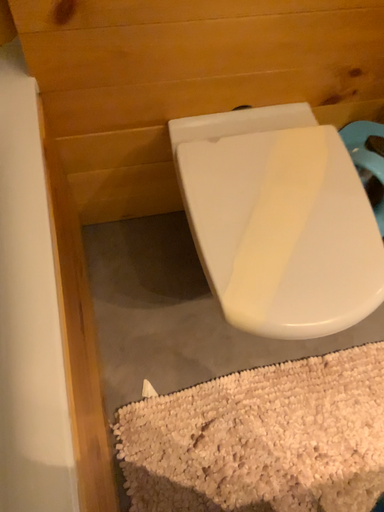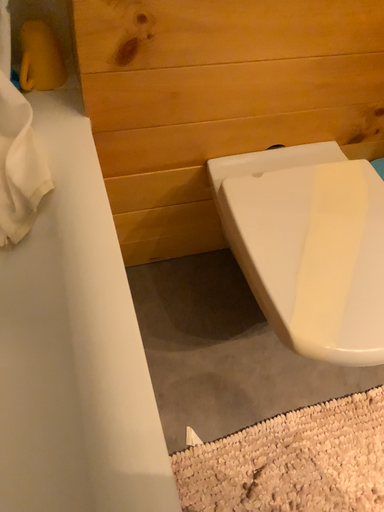
Question: Which way did the camera rotate in the video?

Choices:
 (A) rotated upward
 (B) rotated downward

Answer: (A)